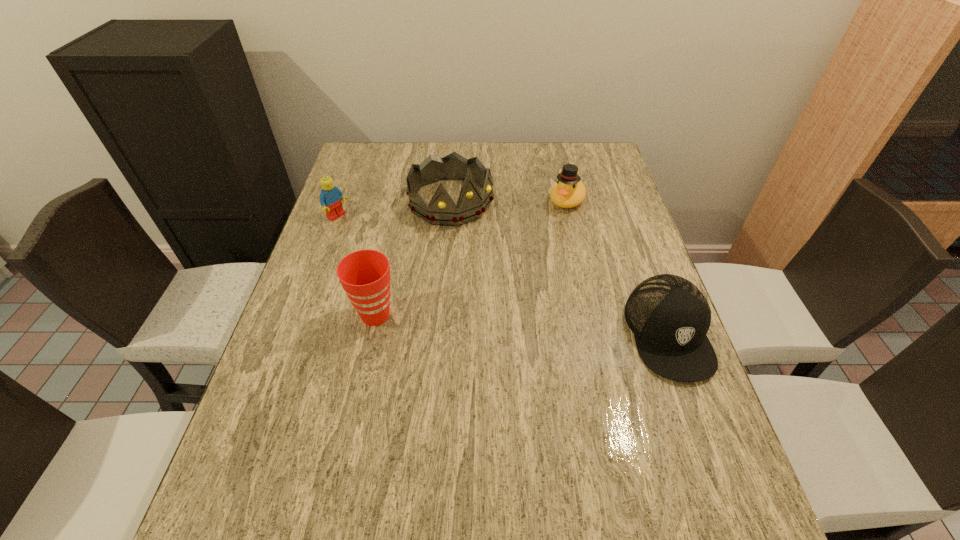
Identify the location of duck that is at the right edge. The height and width of the screenshot is (540, 960). (569, 191).

The width and height of the screenshot is (960, 540). Find the location of `vacant space at the far edge`. vacant space at the far edge is located at coordinates (511, 180).

You are a GUI agent. You are given a task and a screenshot of the screen. Output one action in this format:
    pyautogui.click(x=<x>, y=<y>)
    Task: Click on the vacant region at the near edge of the desktop
    The height and width of the screenshot is (540, 960).
    Given the screenshot: What is the action you would take?
    pyautogui.click(x=510, y=438)

The height and width of the screenshot is (540, 960). I want to click on vacant region at the left edge of the desktop, so click(365, 197).

Where is `vacant region at the right edge`? This screenshot has height=540, width=960. vacant region at the right edge is located at coordinates [636, 381].

This screenshot has height=540, width=960. In order to click on blank space at the far left corner of the desktop in this screenshot , I will do `click(376, 155)`.

Where is `vacant space at the far right corner`? vacant space at the far right corner is located at coordinates (568, 143).

What are the coordinates of `free space at the near right corner` in the screenshot? It's located at (683, 450).

Find the location of a particular element. vacant region between the cap and the second object from right to left is located at coordinates (617, 267).

You are a GUI agent. You are given a task and a screenshot of the screen. Output one action in this format:
    pyautogui.click(x=<x>, y=<y>)
    Task: Click on the free space that is in between the cap and the leftmost object
    The image size is (960, 540).
    Given the screenshot: What is the action you would take?
    pyautogui.click(x=503, y=275)